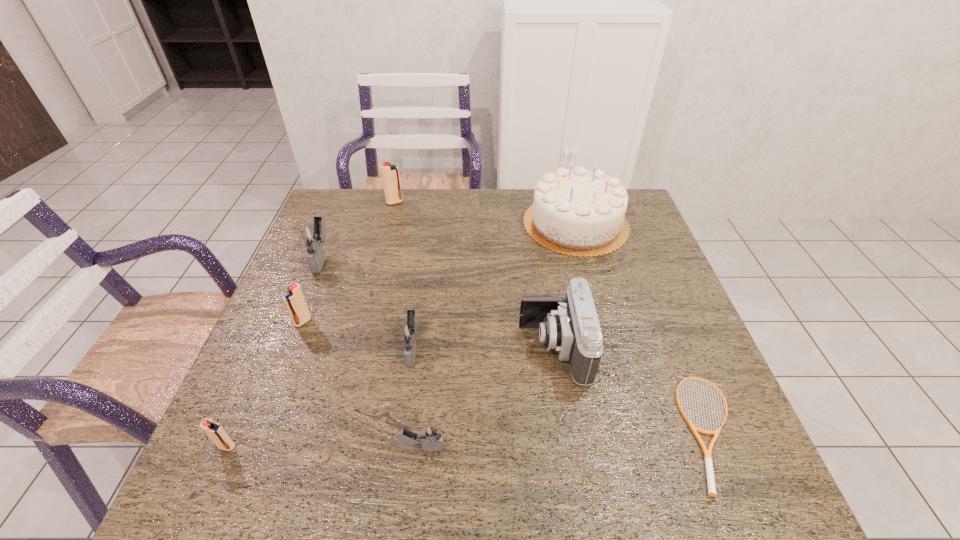
Locate which igniter is the third closest to the nearest gray igniter. Please provide its 2D coordinates. Your answer should be formatted as a tuple, i.e. [(x, y)], where the tuple contains the x and y coordinates of a point satisfying the conditions above.

[(294, 300)]

Identify which red igniter is the closest to the shortest object. Please provide its 2D coordinates. Your answer should be formatted as a tuple, i.e. [(x, y)], where the tuple contains the x and y coordinates of a point satisfying the conditions above.

[(294, 300)]

Image resolution: width=960 pixels, height=540 pixels. I want to click on red igniter object that ranks as the second closest to the tallest object, so click(294, 300).

Choose which gray igniter is the nearest neighbor to the camera. Please provide its 2D coordinates. Your answer should be formatted as a tuple, i.e. [(x, y)], where the tuple contains the x and y coordinates of a point satisfying the conditions above.

[(431, 438)]

Select which gray igniter appears as the second closest to the tallest object. Please provide its 2D coordinates. Your answer should be formatted as a tuple, i.e. [(x, y)], where the tuple contains the x and y coordinates of a point satisfying the conditions above.

[(312, 235)]

The image size is (960, 540). I want to click on free space that satisfies the following two spatial constraints: 1. on the back side of the birthday cake; 2. on the right side of the nearest red igniter, so click(324, 224).

Locate an element on the screen. vacant position in the image that satisfies the following two spatial constraints: 1. at the front of the camera with an open lens cover; 2. on the left side of the shortest object is located at coordinates (566, 431).

Identify the location of free point that satisfies the following two spatial constraints: 1. on the back side of the birthday cake; 2. on the right side of the second farthest igniter. (336, 224).